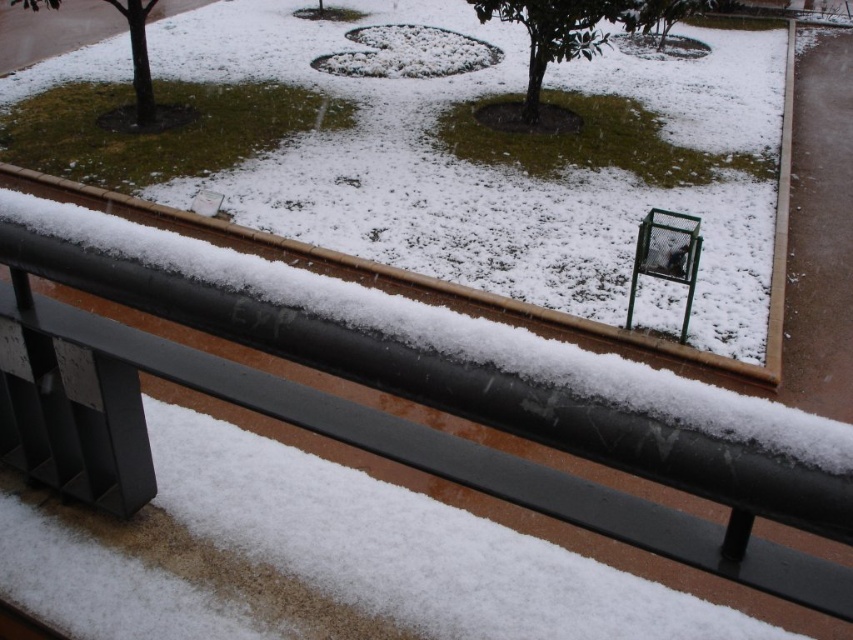
Question: Does green matte tree at center appear under green matte tree at upper left?

Choices:
 (A) no
 (B) yes

Answer: (B)

Question: Which of the following is the closest to the observer?

Choices:
 (A) green matte tree at center
 (B) green matte tree at upper left

Answer: (A)

Question: Which point is farther to the camera?

Choices:
 (A) (44, 4)
 (B) (549, 61)

Answer: (A)

Question: Does green matte tree at center appear on the right side of green matte tree at upper left?

Choices:
 (A) yes
 (B) no

Answer: (A)

Question: Does green matte tree at center have a greater width compared to green matte tree at upper left?

Choices:
 (A) no
 (B) yes

Answer: (A)